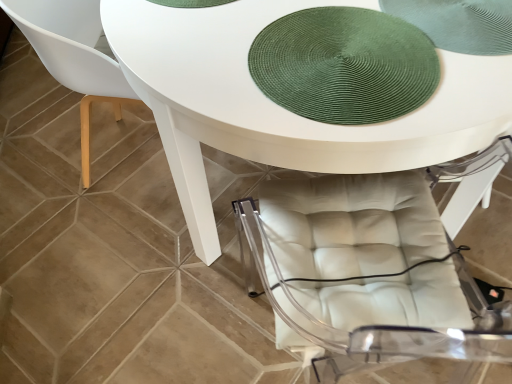
At what (x,y) coordinates should I click in order to perform the action: click on free region under green woven mat at upper center (from a real-world perspective). Please return your answer as a coordinate pair (x, y). Looking at the image, I should click on (334, 54).